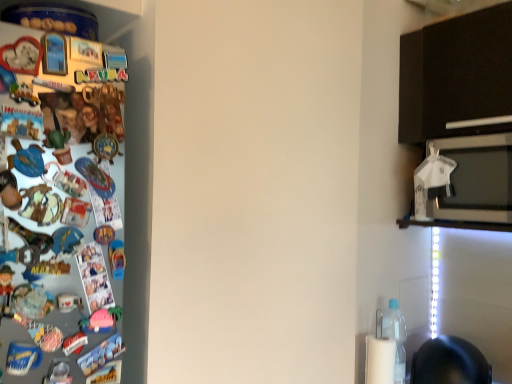
This screenshot has height=384, width=512. In order to click on white glossy microwave oven at upper right in this screenshot , I will do `click(466, 180)`.

Find the location of a particular element. The image size is (512, 384). clear plastic bottle at lower right is located at coordinates (396, 338).

Considering the points (455, 217) and (386, 311), which point is in front, point (455, 217) or point (386, 311)?

The point (455, 217) is more forward.

Is white glossy microwave oven at upper right facing towards clear plastic bottle at lower right?

No, white glossy microwave oven at upper right is not turned towards clear plastic bottle at lower right.

Is white glossy microwave oven at upper right next to clear plastic bottle at lower right and touching it?

No, white glossy microwave oven at upper right is not making contact with clear plastic bottle at lower right.

Consider the image. From a real-world perspective, which object rests below the other?

clear plastic bottle at lower right is physically lower.

Considering the sizes of clear plastic bottle at lower right and white plastic umbrella at upper right in the image, is clear plastic bottle at lower right taller or shorter than white plastic umbrella at upper right?

Clearly, clear plastic bottle at lower right is taller compared to white plastic umbrella at upper right.

Who is bigger, clear plastic bottle at lower right or white plastic umbrella at upper right?

With larger size is clear plastic bottle at lower right.

Could you tell me if clear plastic bottle at lower right is facing white plastic umbrella at upper right?

No, clear plastic bottle at lower right does not turn towards white plastic umbrella at upper right.

Can you confirm if clear plastic bottle at lower right is thinner than white plastic umbrella at upper right?

Incorrect, the width of clear plastic bottle at lower right is not less than that of white plastic umbrella at upper right.

From the image's perspective, who appears lower, white glossy microwave oven at upper right or white plastic umbrella at upper right?

white glossy microwave oven at upper right appears lower in the image.

Considering the sizes of white glossy microwave oven at upper right and white plastic umbrella at upper right in the image, is white glossy microwave oven at upper right bigger or smaller than white plastic umbrella at upper right?

white glossy microwave oven at upper right is bigger than white plastic umbrella at upper right.

Is white glossy microwave oven at upper right positioned far away from white plastic umbrella at upper right?

No, white glossy microwave oven at upper right is not far away from white plastic umbrella at upper right.

Based on their sizes in the image, would you say white plastic umbrella at upper right is bigger or smaller than white glossy microwave oven at upper right?

In the image, white plastic umbrella at upper right appears to be smaller than white glossy microwave oven at upper right.

Is white plastic umbrella at upper right facing away from white glossy microwave oven at upper right?

Yes, white plastic umbrella at upper right's orientation is away from white glossy microwave oven at upper right.

From a real-world perspective, which object stands above the other?

white plastic umbrella at upper right is physically above.

From the image's perspective, is white plastic umbrella at upper right over white glossy microwave oven at upper right?

Indeed, from the image's perspective, white plastic umbrella at upper right is shown above white glossy microwave oven at upper right.

From the image's perspective, is clear plastic bottle at lower right on top of white glossy microwave oven at upper right?

No.

Is clear plastic bottle at lower right positioned far away from white glossy microwave oven at upper right?

They are positioned close to each other.

Where is `microwave oven above the clear plastic bottle at lower right (from the image's perspective)`? microwave oven above the clear plastic bottle at lower right (from the image's perspective) is located at coordinates (466, 180).

Can you confirm if clear plastic bottle at lower right is thinner than white glossy microwave oven at upper right?

Correct, the width of clear plastic bottle at lower right is less than that of white glossy microwave oven at upper right.

From a real-world perspective, relative to clear plastic bottle at lower right, is white plastic umbrella at upper right vertically above or below?

From a real-world perspective, white plastic umbrella at upper right is physically above clear plastic bottle at lower right.

Is there a large distance between white plastic umbrella at upper right and clear plastic bottle at lower right?

No.

Is white plastic umbrella at upper right shorter than clear plastic bottle at lower right?

Yes, white plastic umbrella at upper right is shorter than clear plastic bottle at lower right.

Which point is more forward, (x=432, y=144) or (x=397, y=371)?

The point (x=397, y=371) is closer.

I want to click on bottle that appears below the white glossy microwave oven at upper right (from the image's perspective), so click(x=396, y=338).

At what (x,y) coordinates should I click in order to perform the action: click on bottle on the left side of white plastic umbrella at upper right. Please return your answer as a coordinate pair (x, y). Looking at the image, I should click on (396, 338).

Which object lies nearer to the anchor point white glossy microwave oven at upper right, clear plastic bottle at lower right or white plastic umbrella at upper right?

white plastic umbrella at upper right is positioned closer to the anchor white glossy microwave oven at upper right.

Based on their spatial positions, is clear plastic bottle at lower right or white glossy microwave oven at upper right closer to white plastic umbrella at upper right?

Based on the image, white glossy microwave oven at upper right appears to be nearer to white plastic umbrella at upper right.

Estimate the real-world distances between objects in this image. Which object is closer to white plastic umbrella at upper right, white glossy microwave oven at upper right or clear plastic bottle at lower right?

Based on the image, white glossy microwave oven at upper right appears to be nearer to white plastic umbrella at upper right.

From the image, which object appears to be nearer to white glossy microwave oven at upper right, white plastic umbrella at upper right or clear plastic bottle at lower right?

white plastic umbrella at upper right.

Estimate the real-world distances between objects in this image. Which object is further from clear plastic bottle at lower right, white glossy microwave oven at upper right or white plastic umbrella at upper right?

white glossy microwave oven at upper right is positioned further to the anchor clear plastic bottle at lower right.

From the image, which object appears to be farther from clear plastic bottle at lower right, white plastic umbrella at upper right or white glossy microwave oven at upper right?

white glossy microwave oven at upper right is further to clear plastic bottle at lower right.

Where is `microwave oven between white plastic umbrella at upper right and clear plastic bottle at lower right vertically`? microwave oven between white plastic umbrella at upper right and clear plastic bottle at lower right vertically is located at coordinates (466, 180).